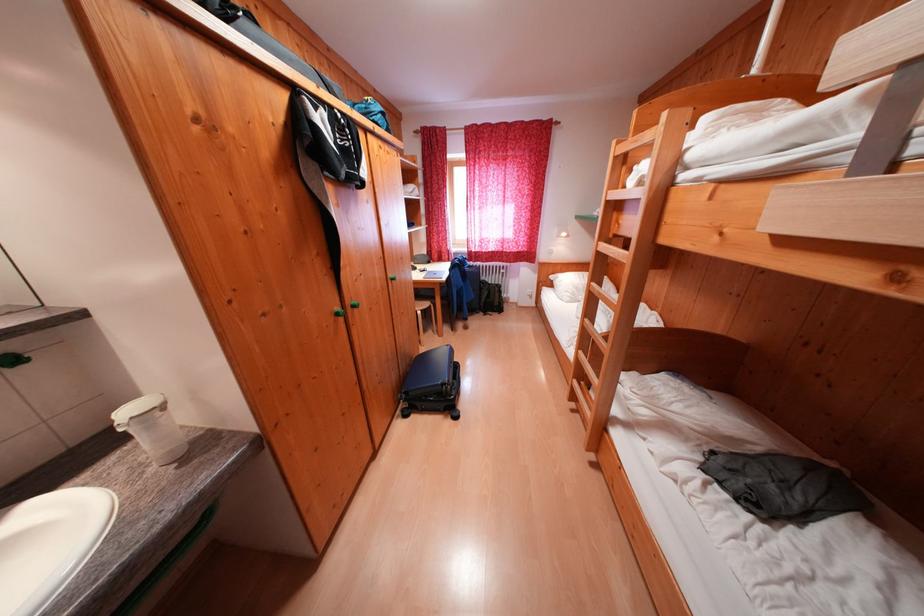
What do you see at coordinates (621, 265) in the screenshot?
I see `a bunk bed ladder` at bounding box center [621, 265].